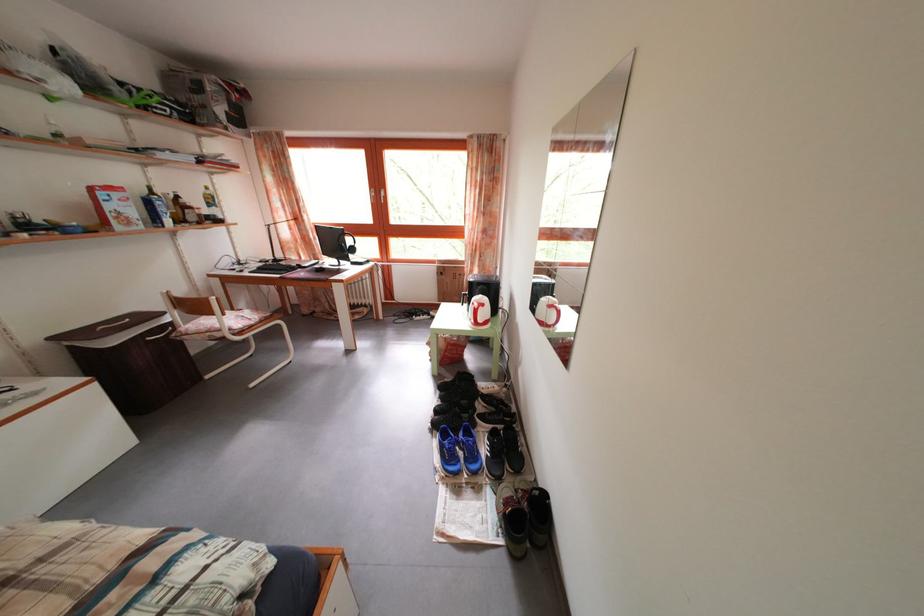
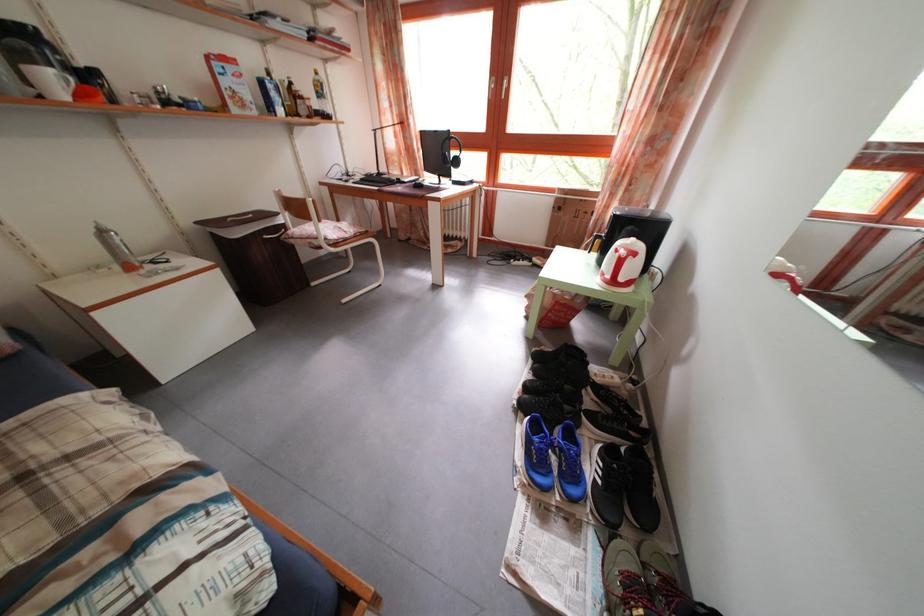
The point at (492, 458) is marked in the first image. Where is the corresponding point in the second image?

(599, 477)